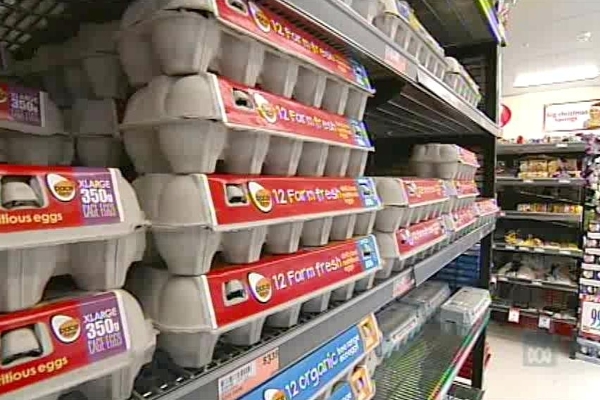
At what (x,y) coordinates should I click in order to perform the action: click on wall poster. Please return your answer as a coordinate pair (x, y). The height and width of the screenshot is (400, 600). Looking at the image, I should click on (581, 109).